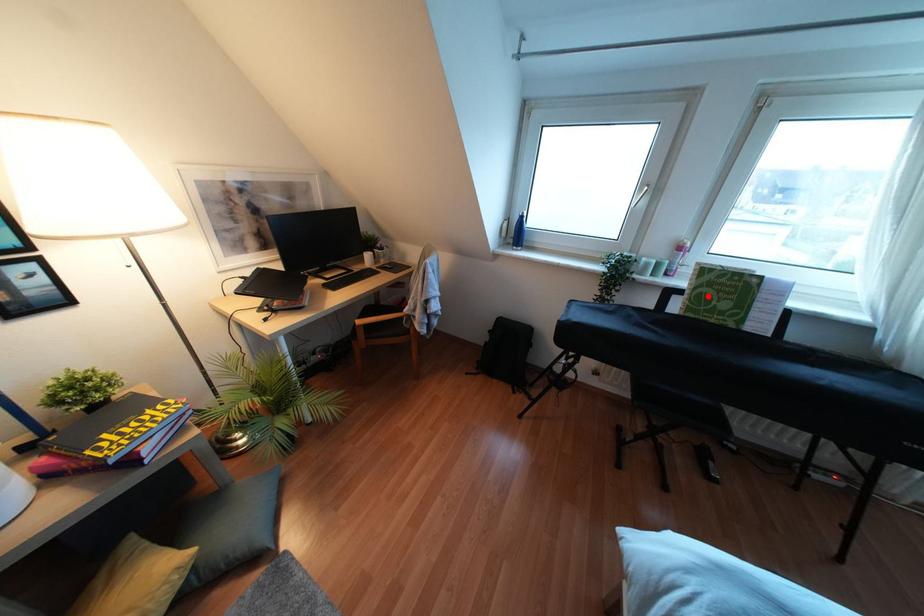
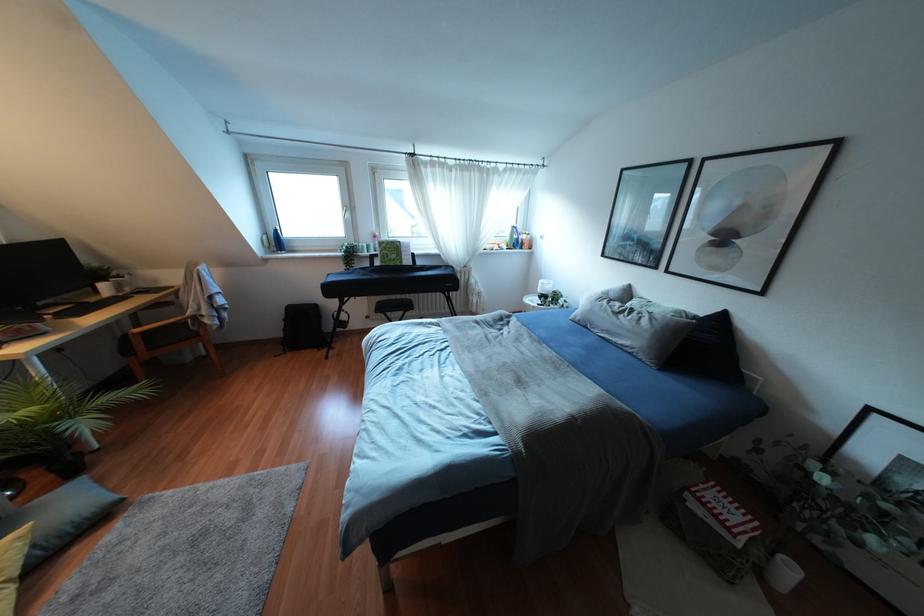
The point at the highlighted location is marked in the first image. Where is the corresponding point in the second image?

(385, 254)